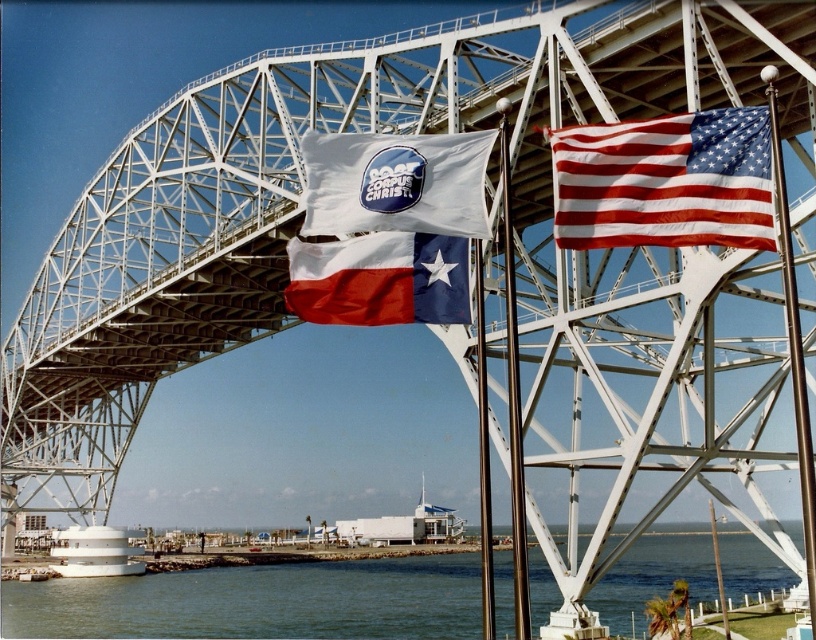
You are standing on the bridge and looking down. You see the green water at lower center and the white fabric flag at center. Which object is closer to you?

The green water at lower center is closer to you because it is further to the viewer than the white fabric flag at center.

You are standing on the bridge and looking at two points marked on your map. The first point is at coordinates point (635, 552) and the second is at point (311, 317). Which point is closer to you?

Point (635, 552) is further to the camera than point (311, 317), so the point closer to you is point (311, 317).